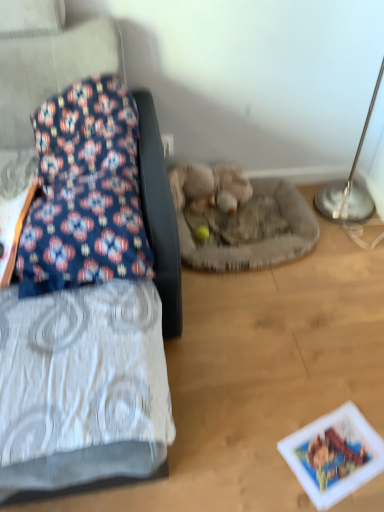
Locate an element on the screen. This screenshot has height=512, width=384. blank space situated above printed paper postcard at lower right (from a real-world perspective) is located at coordinates (340, 453).